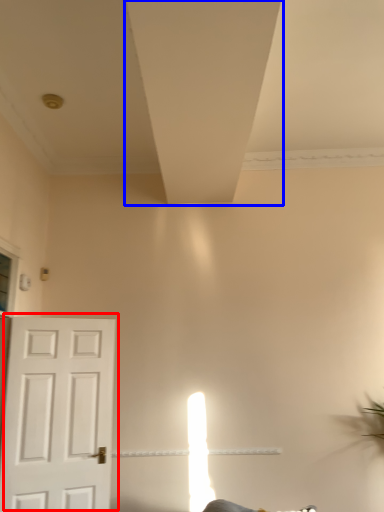
Question: Which object is closer to the camera taking this photo, door (highlighted by a red box) or exhaust hood (highlighted by a blue box)?

Choices:
 (A) door
 (B) exhaust hood

Answer: (B)